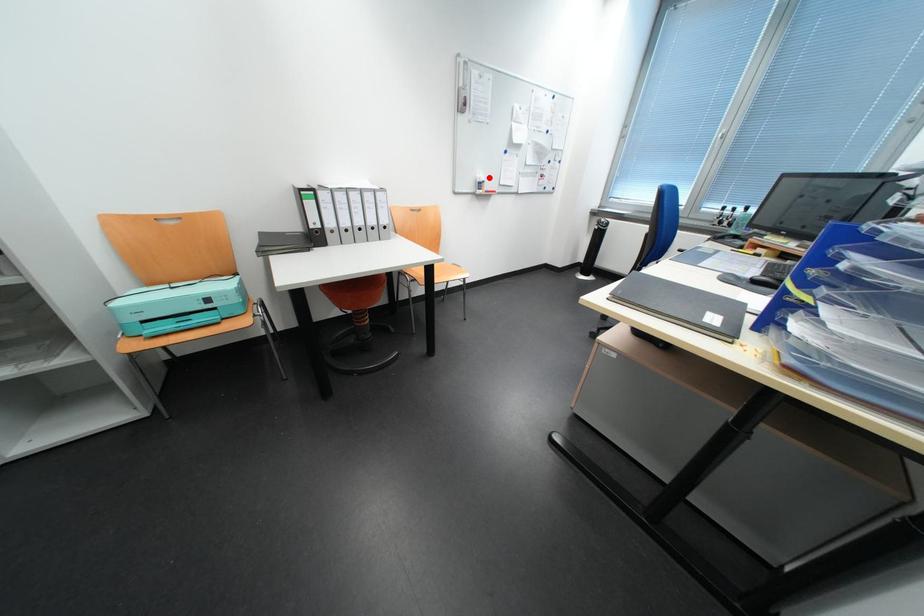
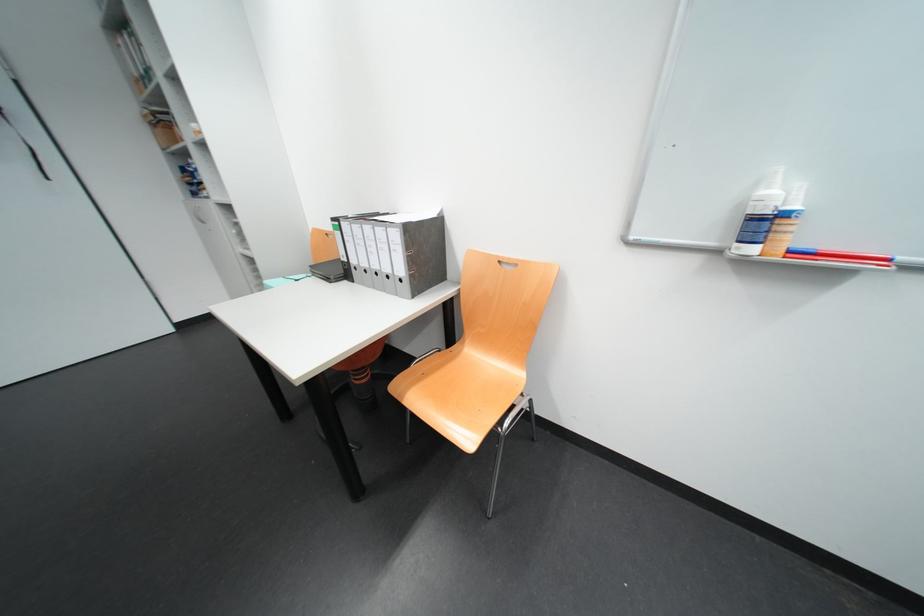
Locate, in the second image, the point that corresponds to the highlighted location in the first image.

(773, 193)